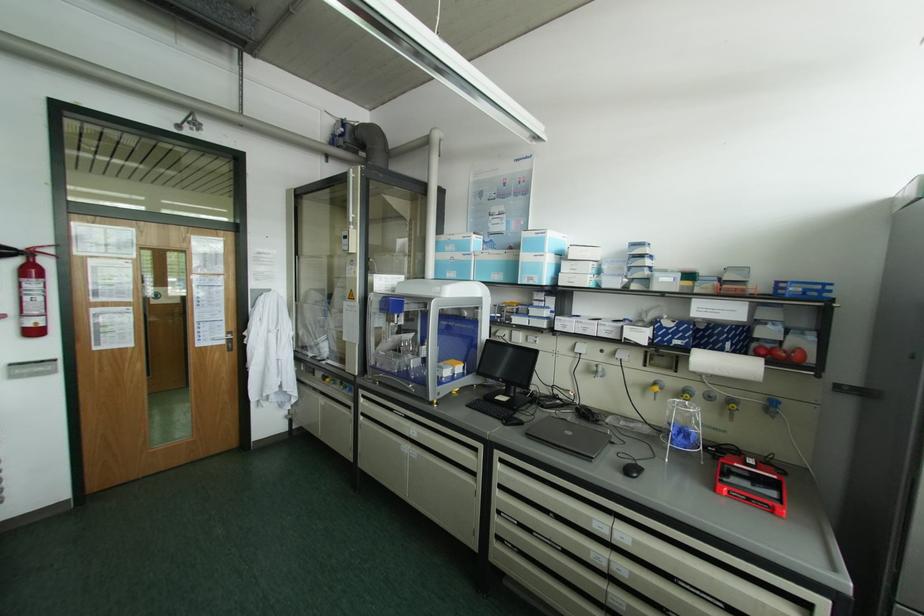
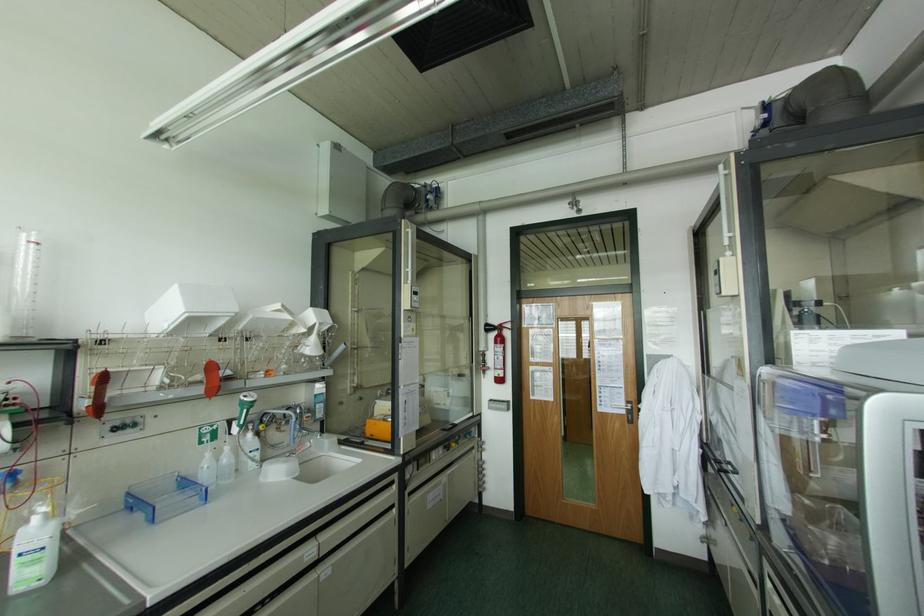
Where in the second image is the point corresponding to (x=227, y=331) from the first image?

(626, 400)